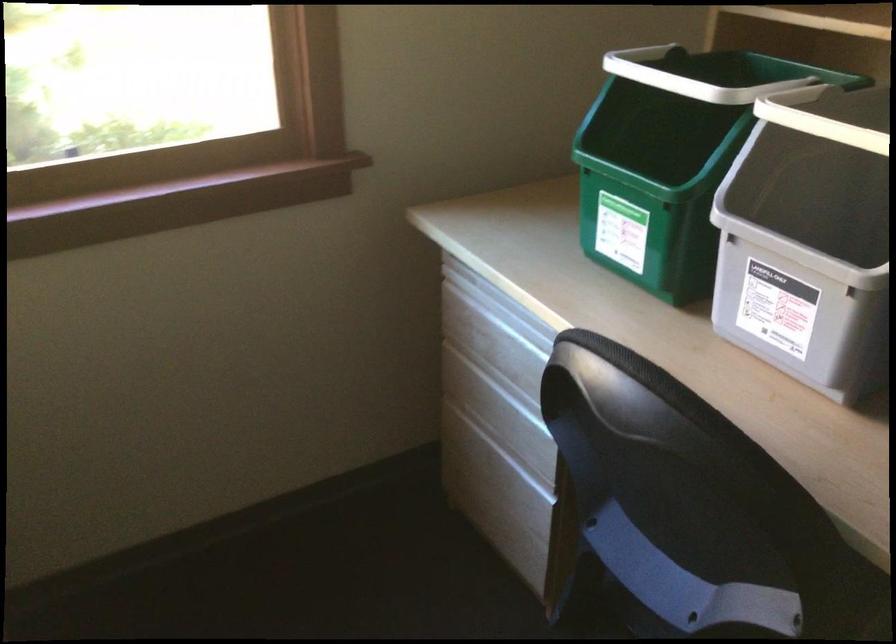
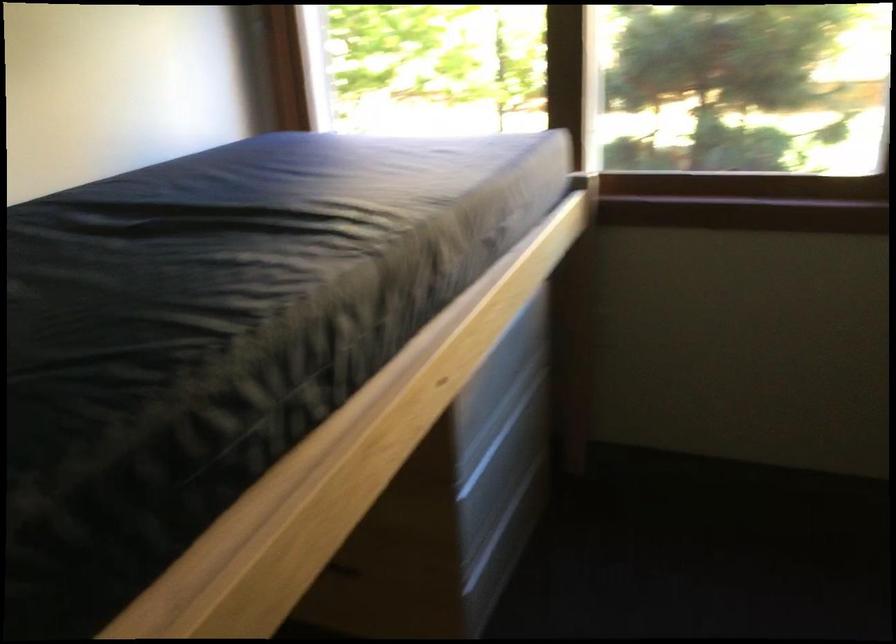
Question: Based on the continuous images, in which direction is the camera rotating? Reply with the corresponding letter.

Choices:
 (A) Left
 (B) Right
 (C) Up
 (D) Down

Answer: (A)